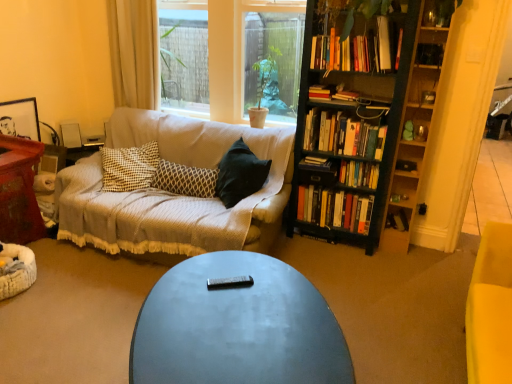
Question: Does clear glass window at center have a greater height compared to hardcover book at upper center, which ranks as the 2th book in top-to-bottom order?

Choices:
 (A) no
 (B) yes

Answer: (B)

Question: Does clear glass window at center have a greater width compared to hardcover book at upper center, which ranks as the 2th book in top-to-bottom order?

Choices:
 (A) no
 (B) yes

Answer: (B)

Question: Would you say clear glass window at center is a long distance from hardcover book at upper center, which ranks as the 2th book in top-to-bottom order?

Choices:
 (A) no
 (B) yes

Answer: (A)

Question: Is clear glass window at center closer to camera compared to hardcover book at upper center, which ranks as the 2th book in top-to-bottom order?

Choices:
 (A) no
 (B) yes

Answer: (A)

Question: From a real-world perspective, is clear glass window at center under hardcover book at upper center, which ranks as the 2th book in top-to-bottom order?

Choices:
 (A) no
 (B) yes

Answer: (A)

Question: From a real-world perspective, is hardcover books at upper right, which ranks as the eighth book in bottom-to-top order, above or below white plastic speaker at upper left?

Choices:
 (A) above
 (B) below

Answer: (A)

Question: Considering the relative positions of hardcover books at upper right, which ranks as the eighth book in bottom-to-top order, and white plastic speaker at upper left in the image provided, is hardcover books at upper right, which ranks as the eighth book in bottom-to-top order, to the left or to the right of white plastic speaker at upper left?

Choices:
 (A) right
 (B) left

Answer: (A)

Question: From the image's perspective, is hardcover books at upper right, which appears as the first book when viewed from the top, above or below white plastic speaker at upper left?

Choices:
 (A) above
 (B) below

Answer: (A)

Question: In terms of height, does hardcover books at upper right, which appears as the first book when viewed from the top, look taller or shorter compared to white plastic speaker at upper left?

Choices:
 (A) tall
 (B) short

Answer: (A)

Question: From a real-world perspective, is wooden table at left above or below hardcover books at center-right, marked as the third book in a bottom-to-top arrangement?

Choices:
 (A) below
 (B) above

Answer: (A)

Question: Relative to hardcover books at center-right, placed as the sixth book when sorted from top to bottom, is wooden table at left in front or behind?

Choices:
 (A) front
 (B) behind

Answer: (A)

Question: From the image's perspective, is wooden table at left located above or below hardcover books at center-right, placed as the sixth book when sorted from top to bottom?

Choices:
 (A) above
 (B) below

Answer: (B)

Question: Considering the positions of wooden table at left and hardcover books at center-right, placed as the sixth book when sorted from top to bottom, in the image, is wooden table at left taller or shorter than hardcover books at center-right, placed as the sixth book when sorted from top to bottom,?

Choices:
 (A) tall
 (B) short

Answer: (A)

Question: In the image, is wooden side table at left positioned in front of or behind green matte plant at center?

Choices:
 (A) behind
 (B) front

Answer: (A)

Question: Considering the relative positions of wooden side table at left and green matte plant at center in the image provided, is wooden side table at left to the left or to the right of green matte plant at center?

Choices:
 (A) right
 (B) left

Answer: (B)